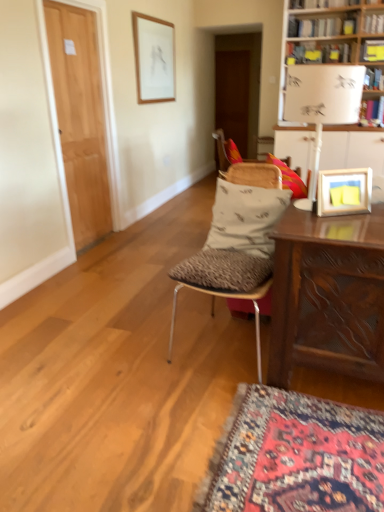
Where is `vacant space underneath metallic silver chair at center, which ranks as the second chair in back-to-front order (from a real-world perspective)`? The image size is (384, 512). vacant space underneath metallic silver chair at center, which ranks as the second chair in back-to-front order (from a real-world perspective) is located at coordinates (226, 342).